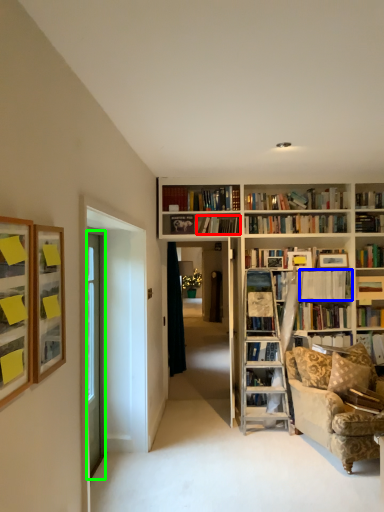
Question: Which object is the farthest from book (highlighted by a red box)? Choose among these: book (highlighted by a blue box) or door (highlighted by a green box).

Choices:
 (A) book
 (B) door

Answer: (B)